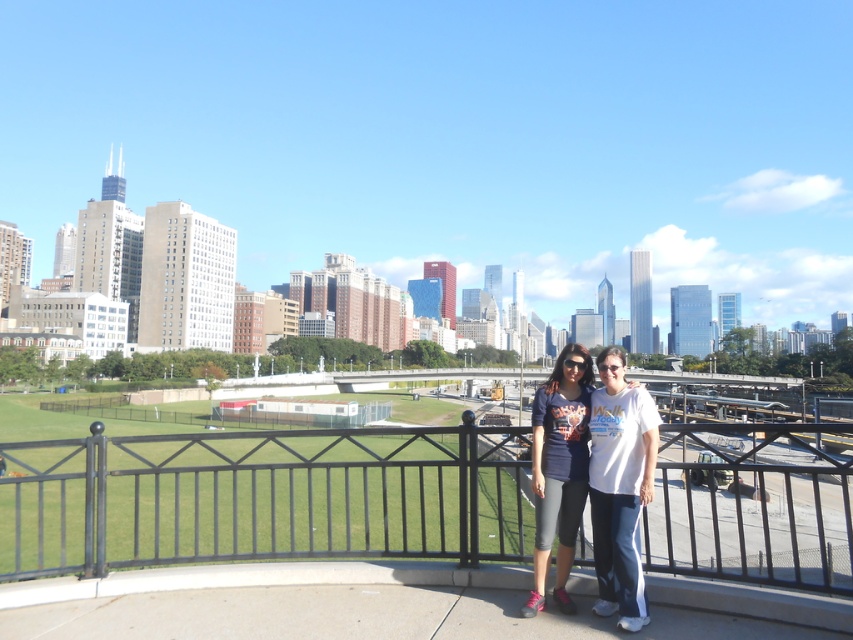
You are a photographer trying to capture a photo of the matte blue shirt at center and the black metal fence at center. Which object should you focus on first if you want to ensure both are in clear focus, considering their sizes?

The black metal fence at center is larger in size than the matte blue shirt at center, so you should focus on the black metal fence at center first to ensure both are in clear focus.

You are a photographer standing at the edge of the walkway. You want to ensure that the black metal fence at center is centered in your photo. Based on its current position, is the fence already aligned with the center of the frame?

The black metal fence at center is located at point coordinates (263, 497), which means it is not exactly at the center of the frame. To center it, you would need to adjust your position or camera angle so that the fence aligns with the frame center.

You are a photographer standing at the edge of a plaza, aiming to capture a photo of the black metal fence at center. You have a camera with a 50mm lens. Considering the distance between you and the fence, will you be able to capture the entire fence in one frame without moving closer or farther away?

The black metal fence at center is 13.73 meters away from the viewer. With a 50mm lens, the field of view is wide enough to capture the entire fence at that distance without needing to adjust your position.